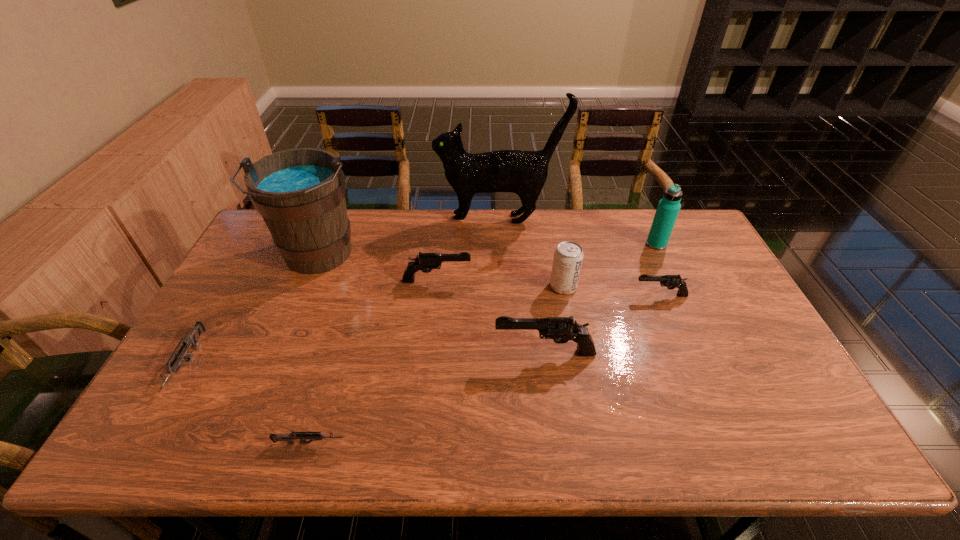
Identify the location of the tallest object. (522, 172).

What are the coordinates of `the farthest object` in the screenshot? It's located at (522, 172).

Locate an element on the screen. This screenshot has height=540, width=960. the second tallest object is located at coordinates (300, 193).

The image size is (960, 540). I want to click on water bottle, so click(668, 208).

Image resolution: width=960 pixels, height=540 pixels. Find the location of `blue water bottle`. blue water bottle is located at coordinates (668, 208).

Identify the location of soda can. The width and height of the screenshot is (960, 540). [568, 257].

The width and height of the screenshot is (960, 540). I want to click on the nearest black gun, so click(561, 329).

Identify the location of the biggest black gun. The height and width of the screenshot is (540, 960). (561, 329).

Identify the location of the third gun from left to right. The image size is (960, 540). (424, 261).

Where is `the fourth shortest gun`? the fourth shortest gun is located at coordinates (424, 261).